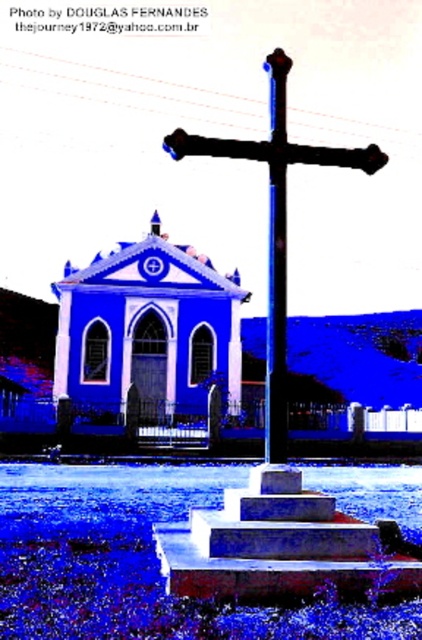
Based on the scene description, what are the coordinates of the blue matte chapel at center?

The blue matte chapel at center is located at coordinates point [148,333].

You are standing at the bottom of the steps and want to walk towards the black metal cross at center. Which direction should you move relative to the blue matte chapel at center?

You should move to the right of the blue matte chapel at center to reach the black metal cross at center since the blue matte chapel at center is to the left of the black metal cross at center.

You are an architect designing a new garden layout around the church. You need to place a decorative flower bed between the black metal cross at center and the metallic pole at center. Which object should the flower bed be closer to to ensure it doesn

The flower bed should be closer to the metallic pole at center because the black metal cross at center is wider than the metallic pole at center, so placing the flower bed closer to the narrower pole would maintain symmetry and balance in the garden layout.